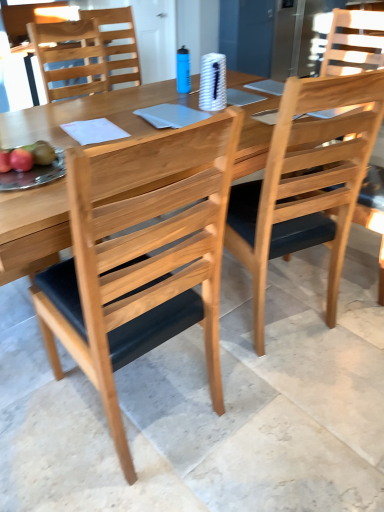
The height and width of the screenshot is (512, 384). I want to click on unoccupied area in front of natural wood chair at center, placed as the third chair when sorted from back to front, so click(109, 476).